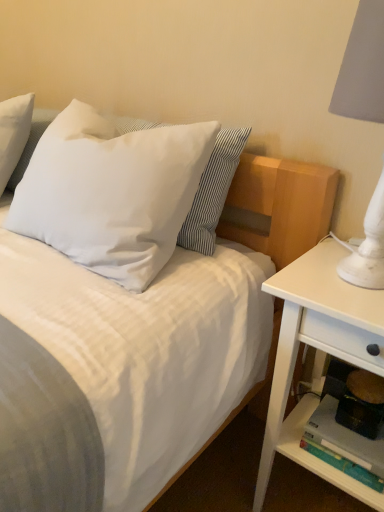
Question: Is white wood nightstand at right at the left side of white soft pillow at upper left, placed as the 1th pillow when sorted from right to left?

Choices:
 (A) no
 (B) yes

Answer: (A)

Question: Is white soft pillow at upper left, placed as the 1th pillow when sorted from right to left, completely or partially inside white wood nightstand at right?

Choices:
 (A) no
 (B) yes

Answer: (A)

Question: Is white wood nightstand at right thinner than white soft pillow at upper left, acting as the second pillow starting from the left?

Choices:
 (A) yes
 (B) no

Answer: (B)

Question: Is white wood nightstand at right far away from white soft pillow at upper left, acting as the second pillow starting from the left?

Choices:
 (A) yes
 (B) no

Answer: (B)

Question: Is white wood nightstand at right at the right side of white soft pillow at upper left, placed as the 1th pillow when sorted from right to left?

Choices:
 (A) yes
 (B) no

Answer: (A)

Question: Considering the positions of white wood nightstand at right and matte plastic shelf at lower right in the image, is white wood nightstand at right wider or thinner than matte plastic shelf at lower right?

Choices:
 (A) wide
 (B) thin

Answer: (A)

Question: Considering the positions of white wood nightstand at right and matte plastic shelf at lower right in the image, is white wood nightstand at right taller or shorter than matte plastic shelf at lower right?

Choices:
 (A) tall
 (B) short

Answer: (A)

Question: From a real-world perspective, relative to matte plastic shelf at lower right, is white wood nightstand at right vertically above or below?

Choices:
 (A) above
 (B) below

Answer: (A)

Question: Is white wood nightstand at right in front of or behind matte plastic shelf at lower right in the image?

Choices:
 (A) behind
 (B) front

Answer: (B)

Question: Choose the correct answer: Is white soft pillow at upper left, acting as the second pillow starting from the left, inside matte plastic shelf at lower right or outside it?

Choices:
 (A) outside
 (B) inside

Answer: (A)

Question: Relative to matte plastic shelf at lower right, is white soft pillow at upper left, acting as the second pillow starting from the left, in front or behind?

Choices:
 (A) front
 (B) behind

Answer: (A)

Question: From a real-world perspective, is white soft pillow at upper left, placed as the 1th pillow when sorted from right to left, positioned above or below matte plastic shelf at lower right?

Choices:
 (A) above
 (B) below

Answer: (A)

Question: Considering the positions of point coord(18,224) and point coord(327,479), is point coord(18,224) closer or farther from the camera than point coord(327,479)?

Choices:
 (A) farther
 (B) closer

Answer: (A)

Question: Is white matte pillow at upper left, positioned as the 2th pillow in right-to-left order, wider or thinner than white wood nightstand at right?

Choices:
 (A) wide
 (B) thin

Answer: (B)

Question: Considering the positions of white matte pillow at upper left, the 1th pillow in the left-to-right sequence, and white wood nightstand at right in the image, is white matte pillow at upper left, the 1th pillow in the left-to-right sequence, bigger or smaller than white wood nightstand at right?

Choices:
 (A) small
 (B) big

Answer: (A)